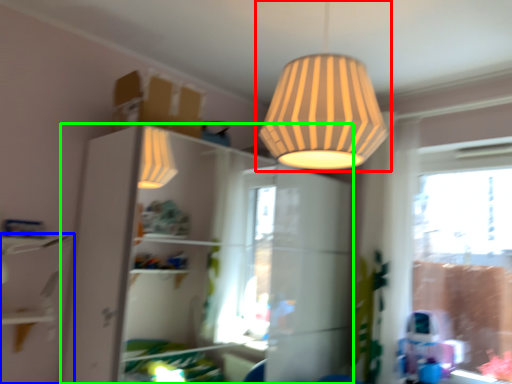
Question: Based on their relative distances, which object is nearer to lamp (highlighted by a red box)? Choose from shelf (highlighted by a blue box) and dresser (highlighted by a green box).

Choices:
 (A) shelf
 (B) dresser

Answer: (A)